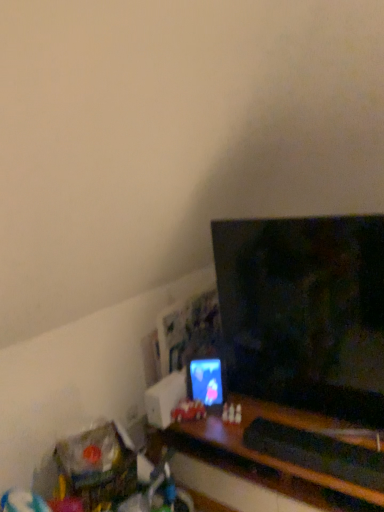
Question: Considering the relative sizes of translucent plastic toy at center and black glossy tv at center in the image provided, is translucent plastic toy at center shorter than black glossy tv at center?

Choices:
 (A) no
 (B) yes

Answer: (B)

Question: Considering the relative sizes of translucent plastic toy at center and black glossy tv at center in the image provided, is translucent plastic toy at center bigger than black glossy tv at center?

Choices:
 (A) no
 (B) yes

Answer: (A)

Question: From a real-world perspective, is translucent plastic toy at center positioned under black glossy tv at center based on gravity?

Choices:
 (A) no
 (B) yes

Answer: (B)

Question: Is translucent plastic toy at center closer to the viewer compared to black glossy tv at center?

Choices:
 (A) yes
 (B) no

Answer: (B)

Question: Does translucent plastic toy at center have a smaller size compared to black glossy tv at center?

Choices:
 (A) no
 (B) yes

Answer: (B)

Question: Is matte plastic phone at center bigger or smaller than translucent plastic toy at center?

Choices:
 (A) small
 (B) big

Answer: (B)

Question: From a real-world perspective, relative to translucent plastic toy at center, is matte plastic phone at center vertically above or below?

Choices:
 (A) below
 (B) above

Answer: (B)

Question: From the image's perspective, is matte plastic phone at center above or below translucent plastic toy at center?

Choices:
 (A) below
 (B) above

Answer: (B)

Question: Considering the positions of point (200, 373) and point (188, 417), is point (200, 373) closer or farther from the camera than point (188, 417)?

Choices:
 (A) farther
 (B) closer

Answer: (A)

Question: Relative to black glossy tv at center, is translucent plastic toy at center in front or behind?

Choices:
 (A) behind
 (B) front

Answer: (A)

Question: From the image's perspective, is translucent plastic toy at center above or below black glossy tv at center?

Choices:
 (A) above
 (B) below

Answer: (B)

Question: Is point (201, 408) positioned closer to the camera than point (382, 248)?

Choices:
 (A) closer
 (B) farther

Answer: (B)

Question: From a real-world perspective, is translucent plastic toy at center positioned above or below black glossy tv at center?

Choices:
 (A) above
 (B) below

Answer: (B)

Question: From a real-world perspective, relative to translucent plastic toy at center, is black glossy tv at center vertically above or below?

Choices:
 (A) below
 (B) above

Answer: (B)

Question: In terms of size, does black glossy tv at center appear bigger or smaller than translucent plastic toy at center?

Choices:
 (A) big
 (B) small

Answer: (A)